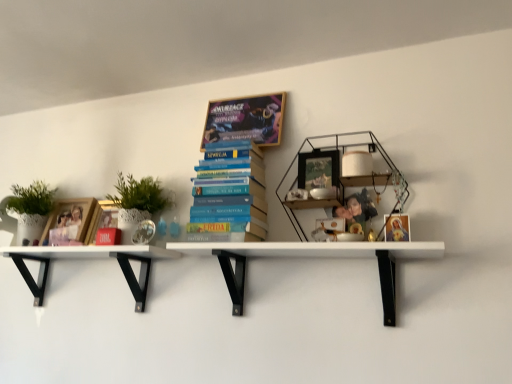
Where is `empty space that is ontop of blue hardcover books at center, the 1th book in the bottom-to-top sequence (from a real-world perspective)`? empty space that is ontop of blue hardcover books at center, the 1th book in the bottom-to-top sequence (from a real-world perspective) is located at coordinates (234, 147).